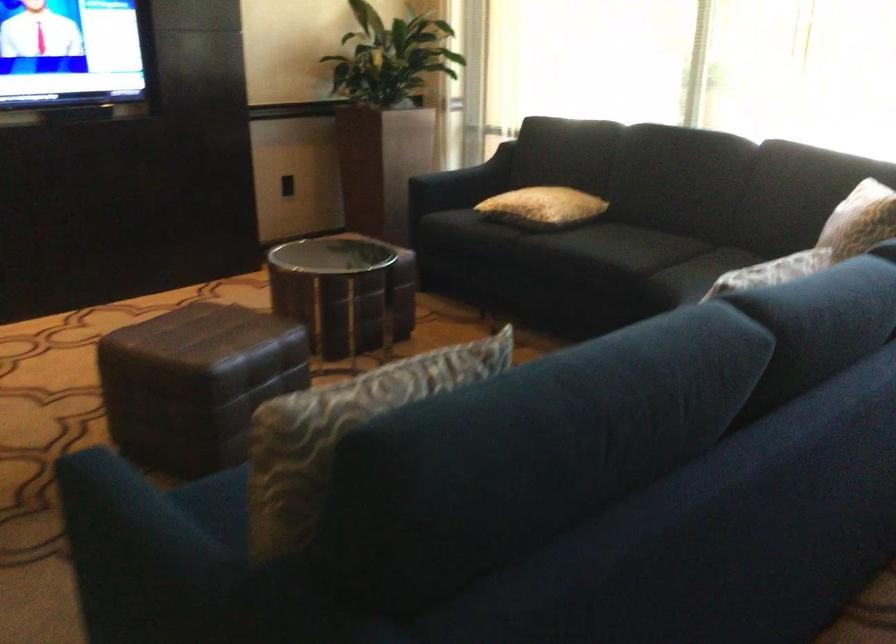
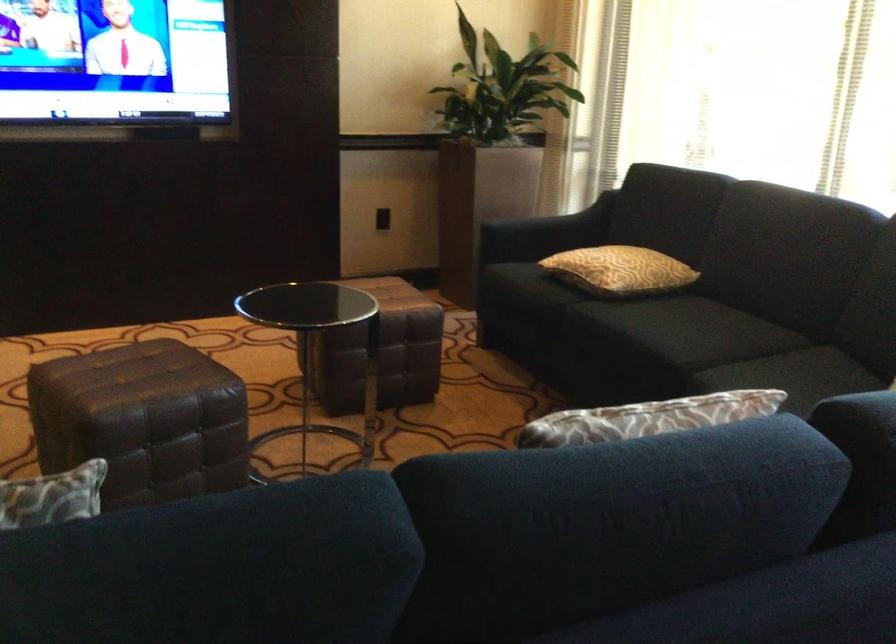
What movement of the cameraman would produce the second image?

The movement direction of the cameraman is right, forward.